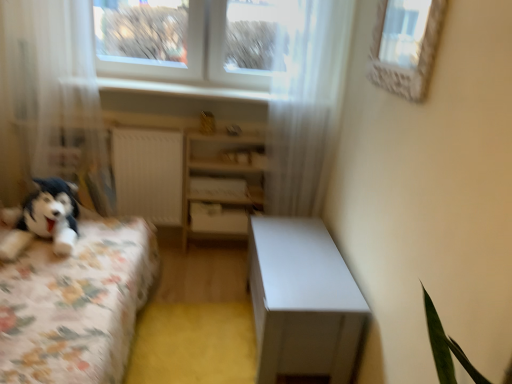
Question: Is white glossy table at center directly adjacent to white matte drawer at center?

Choices:
 (A) no
 (B) yes

Answer: (A)

Question: Considering the relative sizes of white glossy table at center and white matte drawer at center in the image provided, is white glossy table at center shorter than white matte drawer at center?

Choices:
 (A) no
 (B) yes

Answer: (A)

Question: Is white glossy table at center surrounding white matte drawer at center?

Choices:
 (A) no
 (B) yes

Answer: (A)

Question: Is white glossy table at center facing away from white matte drawer at center?

Choices:
 (A) no
 (B) yes

Answer: (A)

Question: Does white glossy table at center have a greater height compared to white matte drawer at center?

Choices:
 (A) no
 (B) yes

Answer: (B)

Question: Is white glossy window sill at upper center taller or shorter than white wood shelf at center?

Choices:
 (A) tall
 (B) short

Answer: (B)

Question: Is point pyautogui.click(x=231, y=92) positioned closer to the camera than point pyautogui.click(x=182, y=211)?

Choices:
 (A) farther
 (B) closer

Answer: (B)

Question: Based on their positions, is white glossy window sill at upper center located to the left or right of white wood shelf at center?

Choices:
 (A) right
 (B) left

Answer: (B)

Question: Is white glossy window sill at upper center wider or thinner than white wood shelf at center?

Choices:
 (A) thin
 (B) wide

Answer: (B)

Question: From a real-world perspective, is white glossy window sill at upper center above or below white sheer curtain at left, the 2th curtain when ordered from right to left?

Choices:
 (A) below
 (B) above

Answer: (B)

Question: Considering the positions of white glossy window sill at upper center and white sheer curtain at left, which is the 1th curtain in left-to-right order, in the image, is white glossy window sill at upper center taller or shorter than white sheer curtain at left, which is the 1th curtain in left-to-right order,?

Choices:
 (A) short
 (B) tall

Answer: (A)

Question: Looking at the image, does white glossy window sill at upper center seem bigger or smaller compared to white sheer curtain at left, the 2th curtain when ordered from right to left?

Choices:
 (A) big
 (B) small

Answer: (B)

Question: Choose the correct answer: Is white glossy window sill at upper center inside white sheer curtain at left, the 2th curtain when ordered from right to left, or outside it?

Choices:
 (A) inside
 (B) outside

Answer: (B)

Question: Which is correct: white textured frame at upper right is inside white sheer curtain at left, the 2th curtain when ordered from right to left, or outside of it?

Choices:
 (A) inside
 (B) outside

Answer: (B)

Question: Visually, is white textured frame at upper right positioned to the left or to the right of white sheer curtain at left, which is the 1th curtain in left-to-right order?

Choices:
 (A) left
 (B) right

Answer: (B)